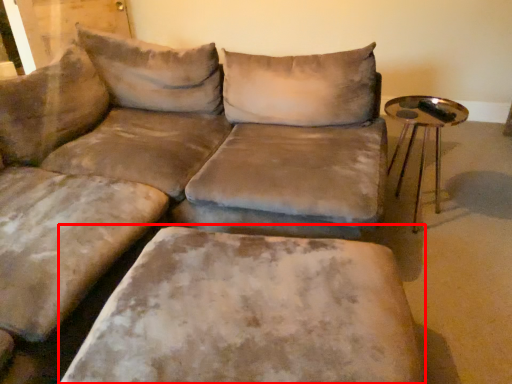
Question: From the image's perspective, considering the relative positions of swivel chair (annotated by the red box) and table in the image provided, where is swivel chair (annotated by the red box) located with respect to the staircase?

Choices:
 (A) below
 (B) above

Answer: (A)